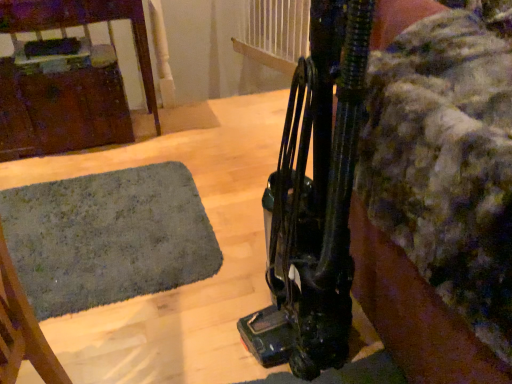
Question: Does black rubber vacuum cleaner at right contain brushed metal cabinet at left?

Choices:
 (A) no
 (B) yes

Answer: (A)

Question: From a real-world perspective, is black rubber vacuum cleaner at right located beneath brushed metal cabinet at left?

Choices:
 (A) yes
 (B) no

Answer: (B)

Question: Does black rubber vacuum cleaner at right appear on the left side of brushed metal cabinet at left?

Choices:
 (A) yes
 (B) no

Answer: (B)

Question: Is black rubber vacuum cleaner at right looking in the opposite direction of brushed metal cabinet at left?

Choices:
 (A) yes
 (B) no

Answer: (B)

Question: Can we say black rubber vacuum cleaner at right lies outside brushed metal cabinet at left?

Choices:
 (A) yes
 (B) no

Answer: (A)

Question: In the image, is black rubber vacuum cleaner at right on the left side or the right side of dark green carpet at lower left?

Choices:
 (A) left
 (B) right

Answer: (B)

Question: In the image, is black rubber vacuum cleaner at right positioned in front of or behind dark green carpet at lower left?

Choices:
 (A) behind
 (B) front

Answer: (B)

Question: From the image's perspective, is black rubber vacuum cleaner at right positioned above or below dark green carpet at lower left?

Choices:
 (A) above
 (B) below

Answer: (A)

Question: Based on their sizes in the image, would you say black rubber vacuum cleaner at right is bigger or smaller than dark green carpet at lower left?

Choices:
 (A) big
 (B) small

Answer: (A)

Question: From the image's perspective, is brushed metal cabinet at left above or below dark green carpet at lower left?

Choices:
 (A) below
 (B) above

Answer: (B)

Question: Is point (73, 77) closer or farther from the camera than point (162, 266)?

Choices:
 (A) closer
 (B) farther

Answer: (B)

Question: In terms of height, does brushed metal cabinet at left look taller or shorter compared to dark green carpet at lower left?

Choices:
 (A) short
 (B) tall

Answer: (B)

Question: Is brushed metal cabinet at left inside or outside of dark green carpet at lower left?

Choices:
 (A) outside
 (B) inside

Answer: (A)

Question: From the image's perspective, is dark green carpet at lower left positioned above or below brushed metal cabinet at left?

Choices:
 (A) above
 (B) below

Answer: (B)

Question: Considering their positions, is dark green carpet at lower left located in front of or behind brushed metal cabinet at left?

Choices:
 (A) front
 (B) behind

Answer: (A)